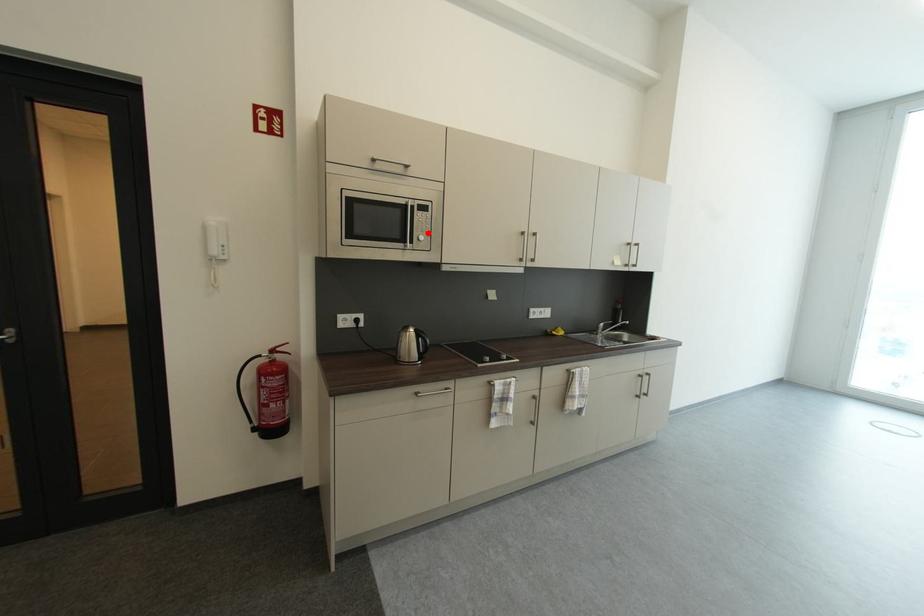
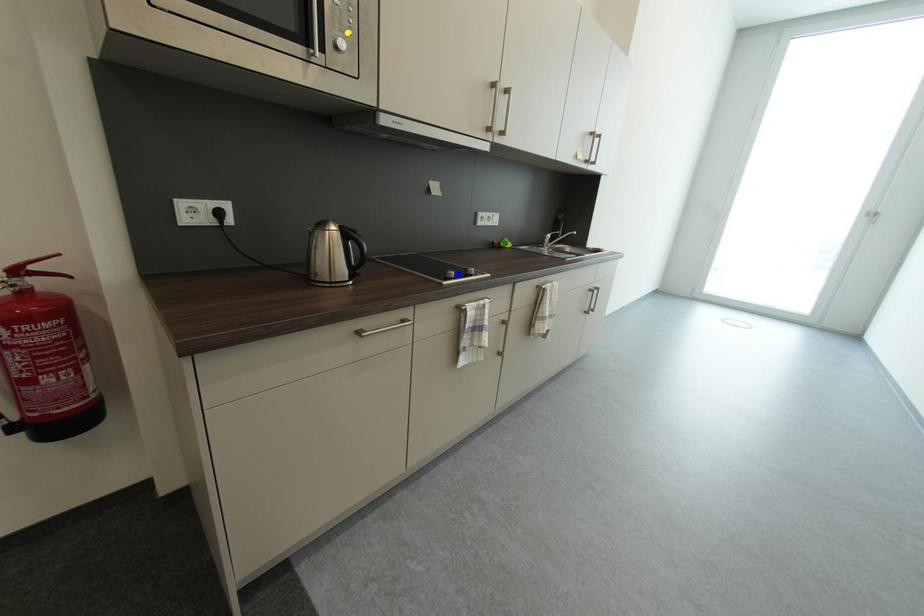
Question: I am providing you with two images of the same scene from different viewpoints. A red point is marked on the first image. You are given multiple points on the second image. In image 2, which mark is for the same physical point as the one in image 1?

Choices:
 (A) yellow point
 (B) blue point
 (C) green point

Answer: (A)